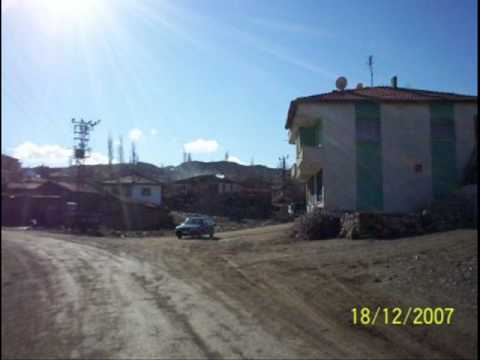
Where is `bblue section on wall`? This screenshot has height=360, width=480. bblue section on wall is located at coordinates (366, 186), (441, 163).